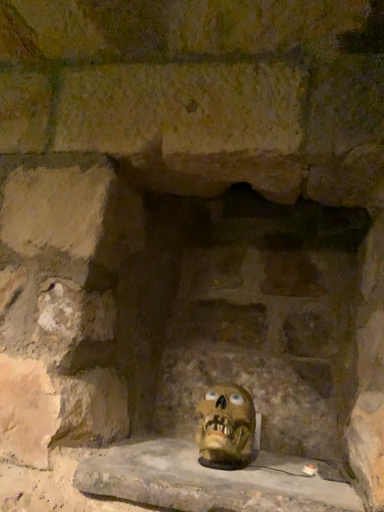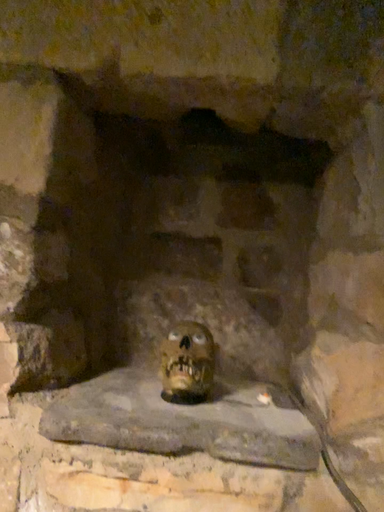
Question: Which way did the camera rotate in the video?

Choices:
 (A) rotated downward
 (B) rotated upward

Answer: (A)